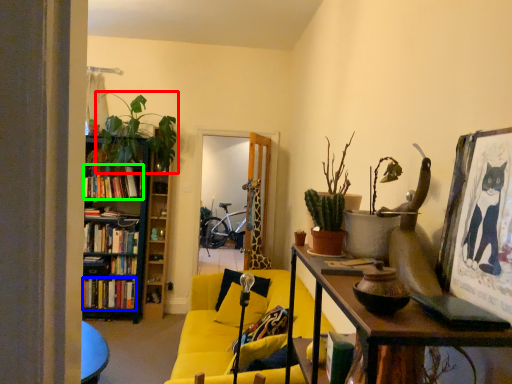
Question: Which object is positioned closest to houseplant (highlighted by a red box)? Select from book (highlighted by a blue box) and book (highlighted by a green box).

Choices:
 (A) book
 (B) book

Answer: (B)